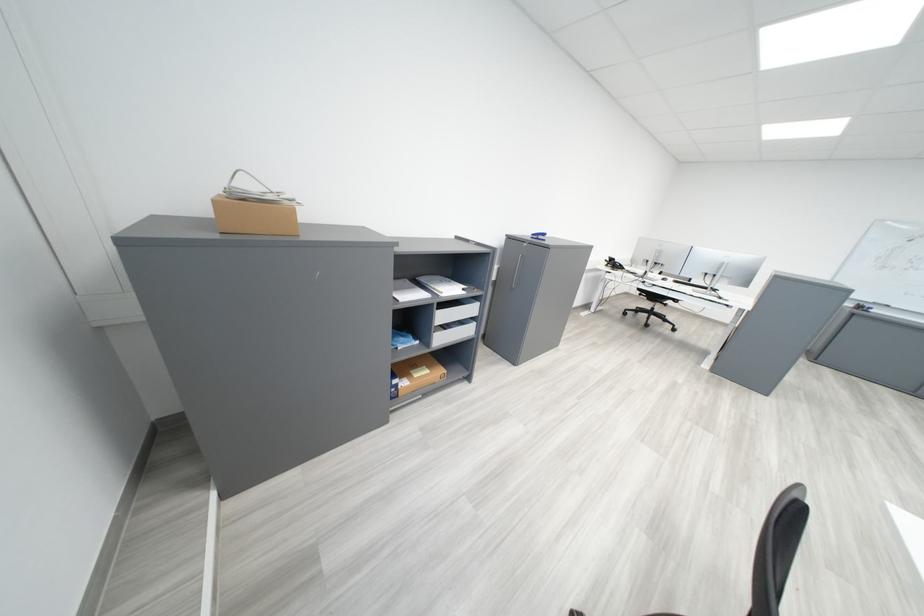
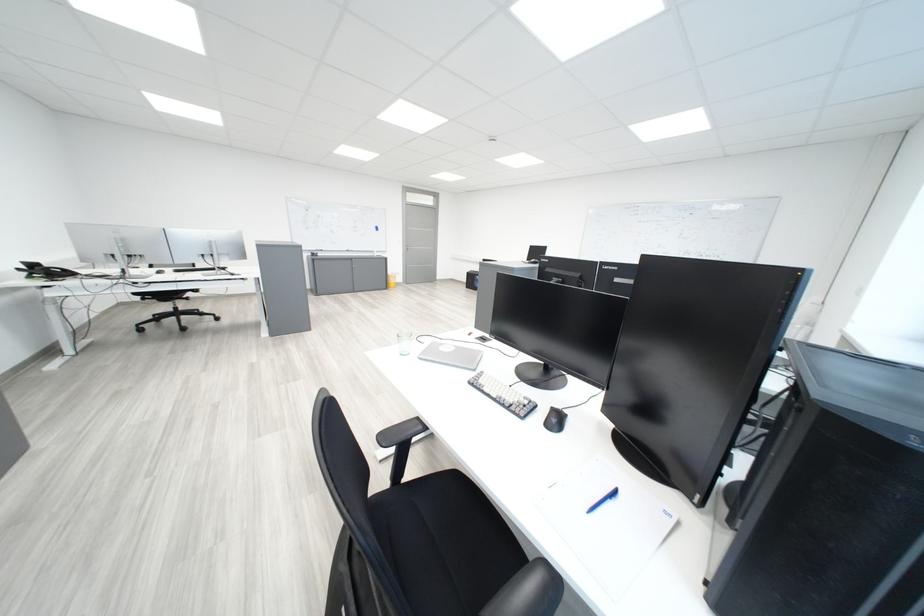
Locate, in the second image, the point that corresponds to the point at 626,265 in the first image.

(59, 275)